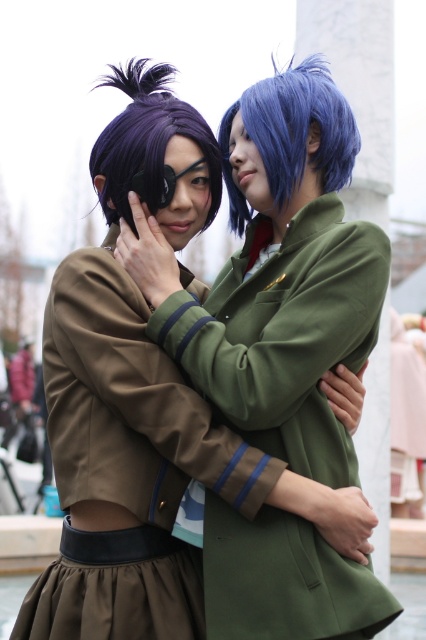
Can you confirm if blue matte wig at center is positioned to the right of purple matte wig at left?

Correct, you'll find blue matte wig at center to the right of purple matte wig at left.

In order to click on blue matte wig at center in this screenshot , I will do `click(291, 134)`.

Locate an element on the screen. blue matte wig at center is located at coordinates (291, 134).

Can you confirm if olive green fabric uniform at center is smaller than purple matte wig at left?

No.

Consider the image. Who is more forward, (198, 362) or (161, 120)?

Positioned in front is point (198, 362).

Image resolution: width=426 pixels, height=640 pixels. I want to click on olive green fabric uniform at center, so click(x=284, y=336).

Can you confirm if olive green fabric uniform at center is positioned above blue matte wig at center?

No, olive green fabric uniform at center is not above blue matte wig at center.

Does olive green fabric uniform at center appear under blue matte wig at center?

Indeed, olive green fabric uniform at center is positioned under blue matte wig at center.

Who is more forward, [244,593] or [259,116]?

Positioned in front is point [244,593].

You are a GUI agent. You are given a task and a screenshot of the screen. Output one action in this format:
    pyautogui.click(x=<x>, y=<y>)
    Task: Click on the olive green fabric uniform at center
    
    Given the screenshot: What is the action you would take?
    click(x=284, y=336)